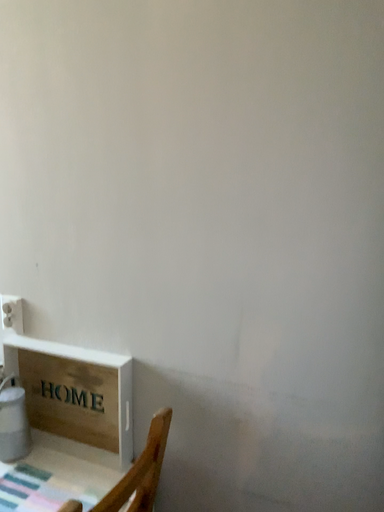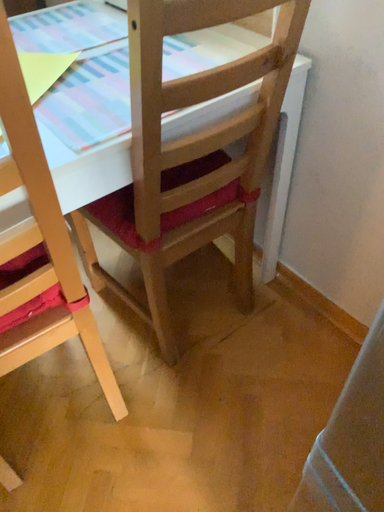
Question: How did the camera likely rotate when shooting the video?

Choices:
 (A) rotated left
 (B) rotated right

Answer: (A)